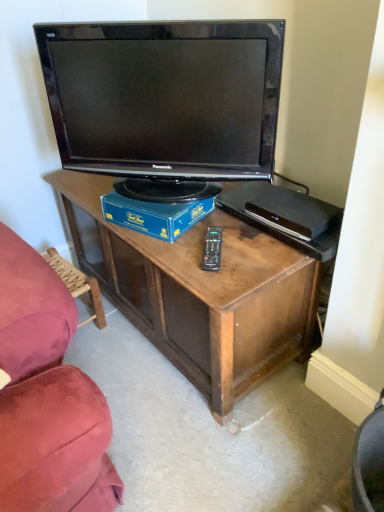
Question: From the image's perspective, is wooden swivel chair at lower left located above or below black plastic remote at center?

Choices:
 (A) above
 (B) below

Answer: (B)

Question: Is wooden swivel chair at lower left to the left or to the right of black plastic remote at center in the image?

Choices:
 (A) left
 (B) right

Answer: (A)

Question: Which object is positioned closest to the wooden swivel chair at lower left?

Choices:
 (A) black plastic remote at center
 (B) matte black television at center
 (C) blue cardboard box at center

Answer: (C)

Question: Which object is positioned closest to the black plastic remote at center?

Choices:
 (A) blue cardboard box at center
 (B) matte black television at center
 (C) wooden swivel chair at lower left

Answer: (A)